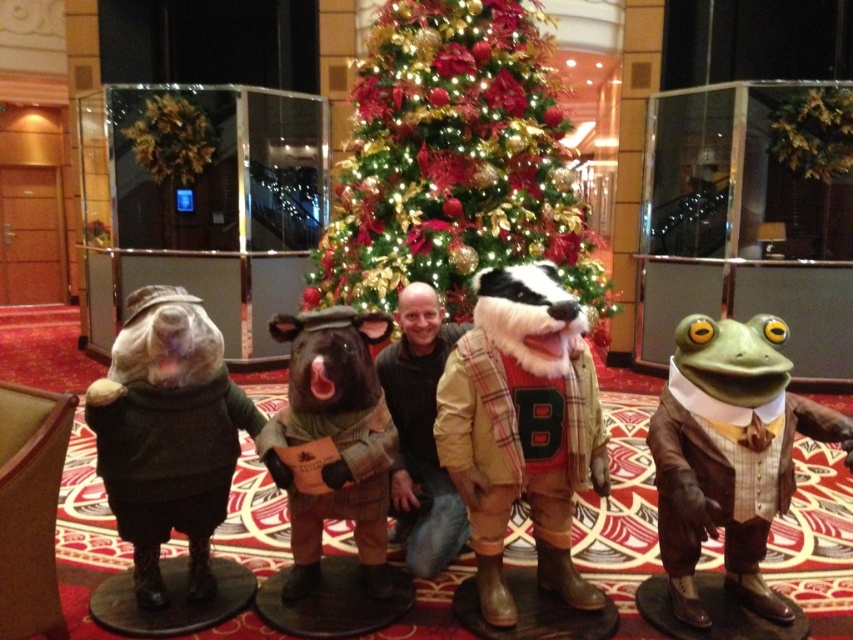
Is matte brown plush bear at left to the right of green fabric frog at center from the viewer's perspective?

Incorrect, matte brown plush bear at left is not on the right side of green fabric frog at center.

Is matte brown plush bear at left in front of green fabric frog at center?

No, matte brown plush bear at left is further to the viewer.

Locate an element on the screen. matte brown plush bear at left is located at coordinates (167, 435).

The width and height of the screenshot is (853, 640). I want to click on matte brown plush bear at left, so click(167, 435).

Identify the location of green shiny christmas tree at center. pos(456,163).

Between green shiny christmas tree at center and matte brown plush bear at left, which one has more height?

green shiny christmas tree at center is taller.

Where is `green shiny christmas tree at center`? The width and height of the screenshot is (853, 640). green shiny christmas tree at center is located at coordinates click(x=456, y=163).

Is fuzzy beige jacket at center wider than green fabric frog at center?

A: Indeed, fuzzy beige jacket at center has a greater width compared to green fabric frog at center.

Between point (517, 355) and point (305, 413), which one is positioned behind?

The point (305, 413) is behind.

Find the location of a particular element. fuzzy beige jacket at center is located at coordinates (521, 428).